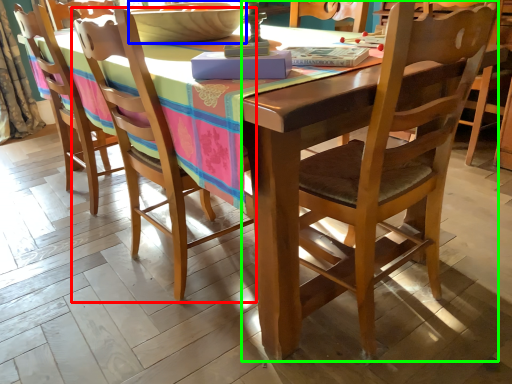
Question: Which object is positioned closest to chair (highlighted by a red box)? Select from bowl (highlighted by a blue box) and chair (highlighted by a green box).

Choices:
 (A) bowl
 (B) chair

Answer: (A)